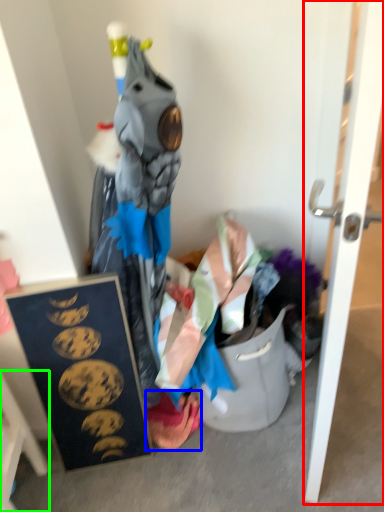
Question: Based on their relative distances, which object is farther from door (highlighted by a red box)? Choose from underclothes (highlighted by a blue box) and furniture (highlighted by a green box).

Choices:
 (A) underclothes
 (B) furniture

Answer: (B)